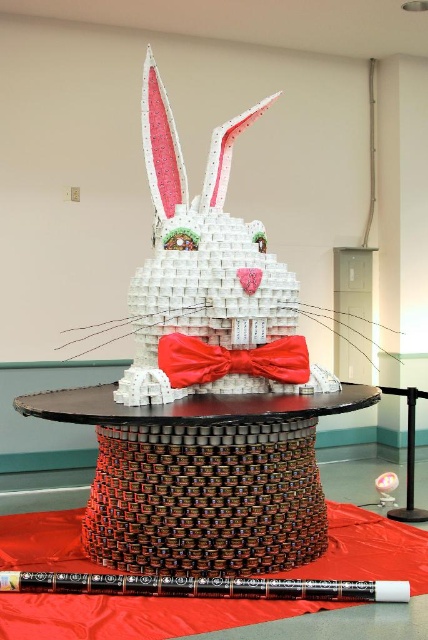
Does wooden table at center have a larger size compared to shiny satin bow tie at center?

Yes, wooden table at center is bigger than shiny satin bow tie at center.

Is wooden table at center smaller than shiny satin bow tie at center?

No, wooden table at center is not smaller than shiny satin bow tie at center.

Does point (228, 460) lie behind point (202, 371)?

No, (228, 460) is in front of (202, 371).

Image resolution: width=428 pixels, height=640 pixels. Identify the location of wooden table at center. (202, 477).